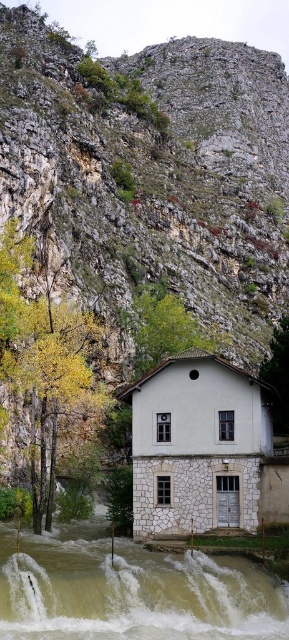
Question: Which object is the farthest from the green leafy tree at center?

Choices:
 (A) green leafy tree at right
 (B) brown stone river at lower center

Answer: (B)

Question: Considering the relative positions of brown stone river at lower center and green leafy tree at center in the image provided, where is brown stone river at lower center located with respect to green leafy tree at center?

Choices:
 (A) left
 (B) right

Answer: (A)

Question: Which point is farther to the camera?

Choices:
 (A) (280, 417)
 (B) (273, 577)

Answer: (A)

Question: Does yellow-green leaves at left appear over green leafy tree at right?

Choices:
 (A) no
 (B) yes

Answer: (A)

Question: From the image, what is the correct spatial relationship of yellow-green leaves at left in relation to green leafy tree at center?

Choices:
 (A) above
 (B) below

Answer: (B)

Question: Considering the real-world distances, which object is closest to the green leafy tree at right?

Choices:
 (A) green leafy tree at center
 (B) brown stone river at lower center
 (C) yellow-green leaves at left

Answer: (A)